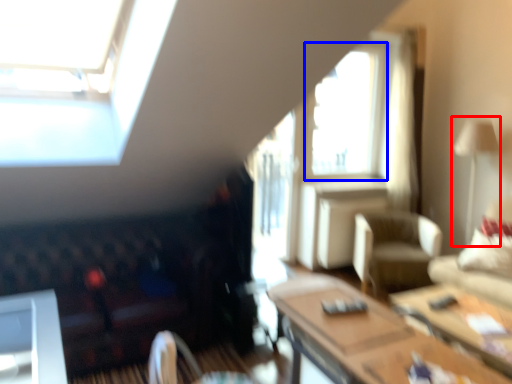
Question: Which object appears farthest to the camera in this image, lamp (highlighted by a red box) or window (highlighted by a blue box)?

Choices:
 (A) lamp
 (B) window

Answer: (B)